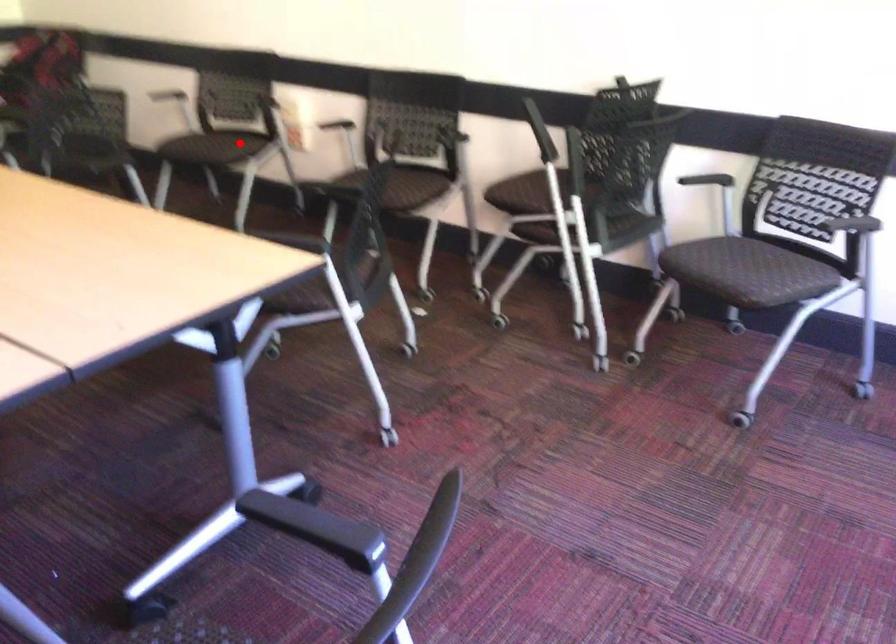
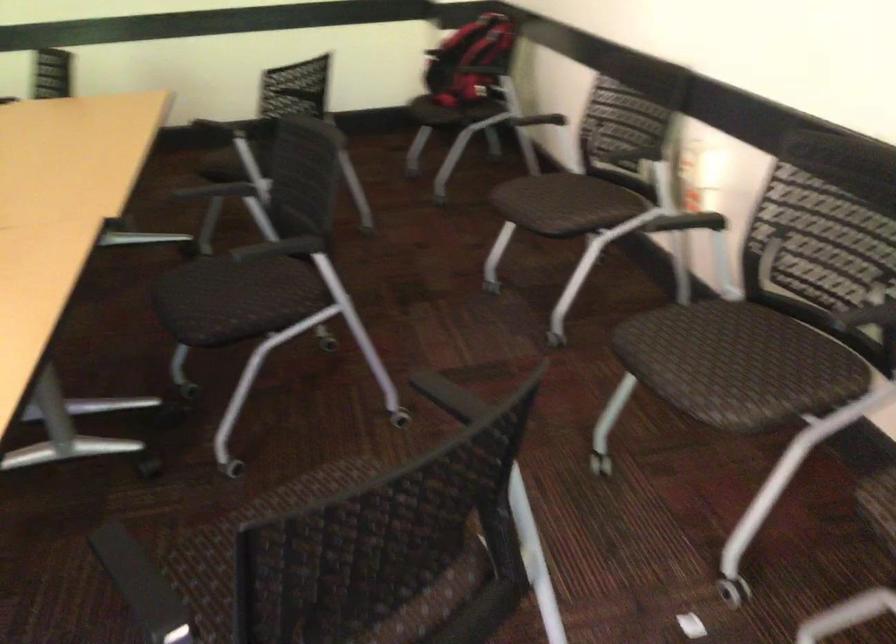
In the second image, find the point that corresponds to the highlighted location in the first image.

(581, 207)